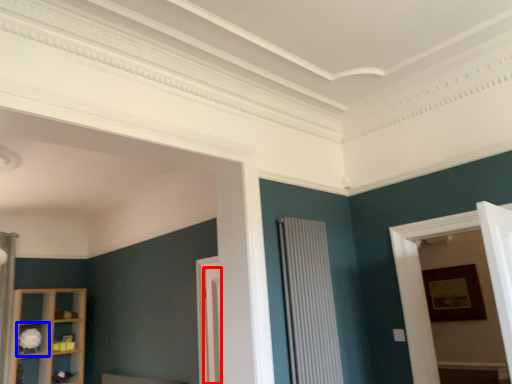
Question: Which point is closer to the camera, door (highlighted by a red box) or shelf (highlighted by a blue box)?

Choices:
 (A) door
 (B) shelf

Answer: (A)